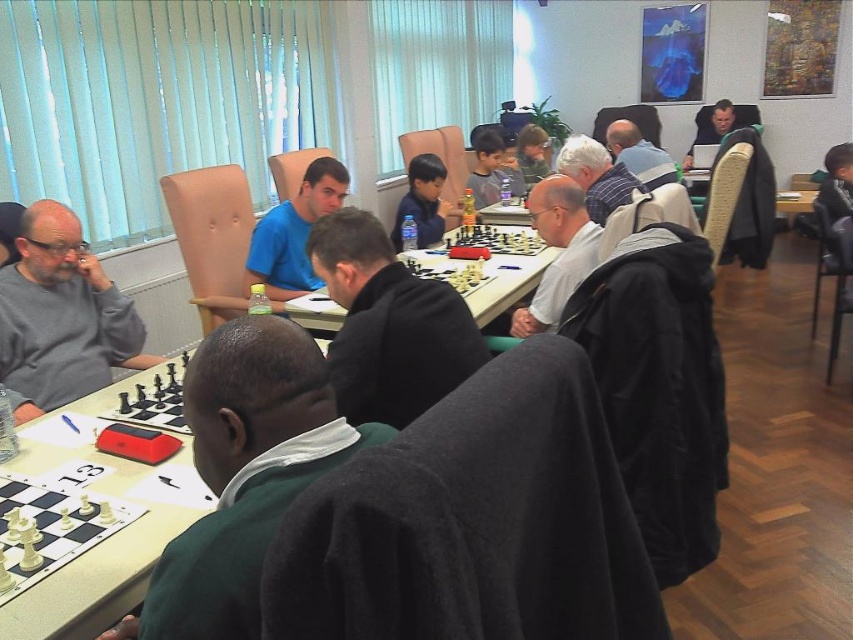
Question: Considering the relative positions of gray wool sweater at center and matte black jacket at upper center in the image provided, where is gray wool sweater at center located with respect to matte black jacket at upper center?

Choices:
 (A) above
 (B) below

Answer: (B)

Question: Is white plastic table at lower left thinner than matte black jacket at upper center?

Choices:
 (A) no
 (B) yes

Answer: (A)

Question: Estimate the real-world distances between objects in this image. Which object is closer to the gray matte sweater at left?

Choices:
 (A) white glossy table at center
 (B) white plastic table at lower left
 (C) white matte jacket at center
 (D) white plastic chess set at lower left

Answer: (B)

Question: Is black plastic chess set at center wider than blue fabric shirt at center?

Choices:
 (A) no
 (B) yes

Answer: (A)

Question: Which object is positioned farthest from the wooden chessboard at center?

Choices:
 (A) gray wool sweater at center
 (B) black plastic chess set at center

Answer: (B)

Question: Estimate the real-world distances between objects in this image. Which object is closer to the dark gray sweater at center?

Choices:
 (A) white plastic table at lower left
 (B) white plastic chess set at lower left
 (C) green fleece robe at lower left

Answer: (A)